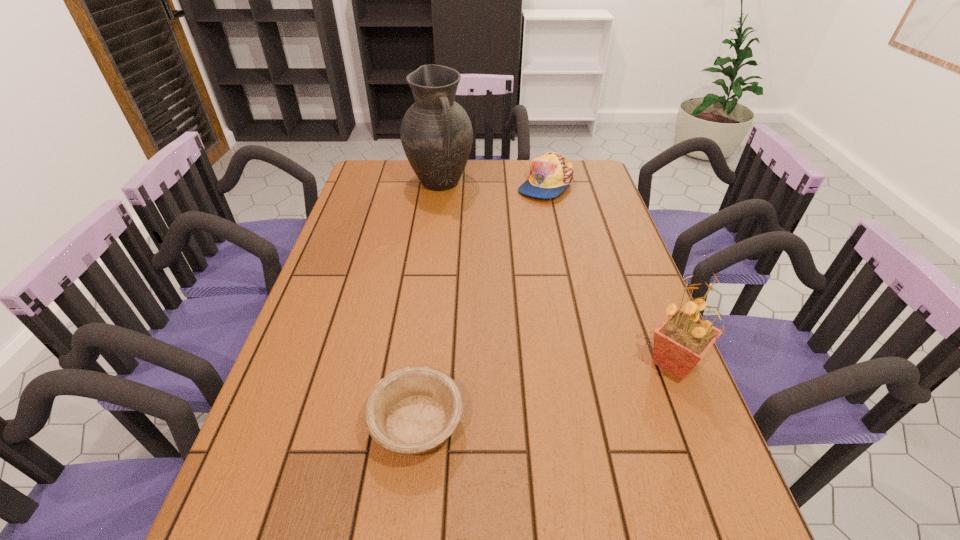
Identify the location of unoccupied area between the shortest object and the second object from right to left. (481, 303).

Image resolution: width=960 pixels, height=540 pixels. Identify the location of free space between the third object from left to right and the third shortest object. (610, 273).

The width and height of the screenshot is (960, 540). I want to click on free spot between the third shortest object and the tallest object, so click(x=557, y=273).

I want to click on free space between the pitcher and the cap, so click(492, 184).

Locate an element on the screen. This screenshot has height=540, width=960. free space that is in between the shortest object and the second tallest object is located at coordinates (545, 393).

Locate an element on the screen. empty location between the second object from right to left and the pitcher is located at coordinates (492, 184).

Locate an element on the screen. Image resolution: width=960 pixels, height=540 pixels. free area in between the bowl and the second shortest object is located at coordinates (481, 303).

The width and height of the screenshot is (960, 540). I want to click on vacant point located between the second shortest object and the shortest object, so click(x=481, y=303).

Where is `free space between the rightmost object and the shortest object`? Image resolution: width=960 pixels, height=540 pixels. free space between the rightmost object and the shortest object is located at coordinates (545, 393).

Point out which object is positioned as the nearest to the rightmost object. Please provide its 2D coordinates. Your answer should be formatted as a tuple, i.e. [(x, y)], where the tuple contains the x and y coordinates of a point satisfying the conditions above.

[(413, 410)]